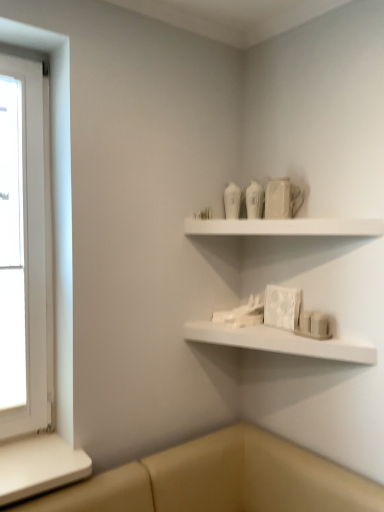
Question: Would you say white wooden window at left is outside white matte shelf at lower center, which is the 1th shelf in bottom-to-top order?

Choices:
 (A) no
 (B) yes

Answer: (B)

Question: Considering the relative sizes of white wooden window at left and white matte shelf at lower center, which is the 1th shelf in bottom-to-top order, in the image provided, is white wooden window at left bigger than white matte shelf at lower center, which is the 1th shelf in bottom-to-top order,?

Choices:
 (A) no
 (B) yes

Answer: (B)

Question: Is white wooden window at left smaller than white matte shelf at lower center, which is the 1th shelf in bottom-to-top order?

Choices:
 (A) no
 (B) yes

Answer: (A)

Question: Could you tell me if white wooden window at left is turned towards white matte shelf at lower center, which is the 1th shelf in bottom-to-top order?

Choices:
 (A) yes
 (B) no

Answer: (B)

Question: Considering the relative sizes of white wooden window at left and white matte shelf at lower center, the 2th shelf viewed from the top, in the image provided, is white wooden window at left taller than white matte shelf at lower center, the 2th shelf viewed from the top,?

Choices:
 (A) no
 (B) yes

Answer: (B)

Question: Considering the relative sizes of white wooden window at left and white matte shelf at lower center, which is the 1th shelf in bottom-to-top order, in the image provided, is white wooden window at left shorter than white matte shelf at lower center, which is the 1th shelf in bottom-to-top order,?

Choices:
 (A) yes
 (B) no

Answer: (B)

Question: Does white matte shelf at upper center, which ranks as the first shelf in top-to-bottom order, have a lesser height compared to white matte shelf at lower center, which is the 1th shelf in bottom-to-top order?

Choices:
 (A) no
 (B) yes

Answer: (A)

Question: Is white matte shelf at upper center, the second shelf when ordered from bottom to top, far from white matte shelf at lower center, the 2th shelf viewed from the top?

Choices:
 (A) no
 (B) yes

Answer: (A)

Question: From a real-world perspective, is white matte shelf at upper center, which ranks as the first shelf in top-to-bottom order, physically above white matte shelf at lower center, the 2th shelf viewed from the top?

Choices:
 (A) yes
 (B) no

Answer: (A)

Question: Does white matte shelf at upper center, which ranks as the first shelf in top-to-bottom order, have a greater height compared to white matte shelf at lower center, the 2th shelf viewed from the top?

Choices:
 (A) yes
 (B) no

Answer: (A)

Question: Is the depth of white matte shelf at upper center, which ranks as the first shelf in top-to-bottom order, greater than that of white matte shelf at lower center, which is the 1th shelf in bottom-to-top order?

Choices:
 (A) yes
 (B) no

Answer: (B)

Question: Does white matte shelf at upper center, the second shelf when ordered from bottom to top, have a lesser width compared to white matte shelf at lower center, which is the 1th shelf in bottom-to-top order?

Choices:
 (A) yes
 (B) no

Answer: (A)

Question: Is white wooden window at left located within white matte shelf at lower center, the 2th shelf viewed from the top?

Choices:
 (A) yes
 (B) no

Answer: (B)